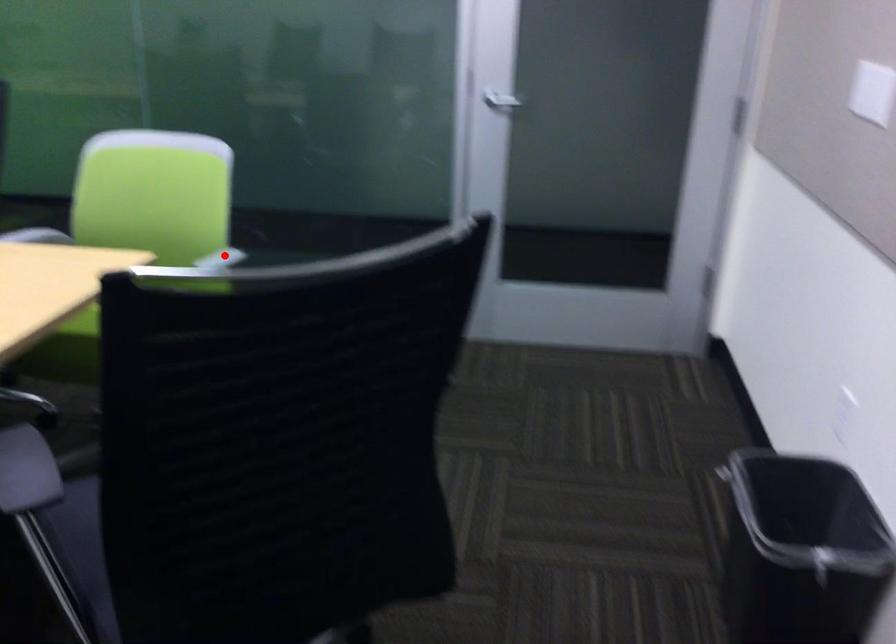
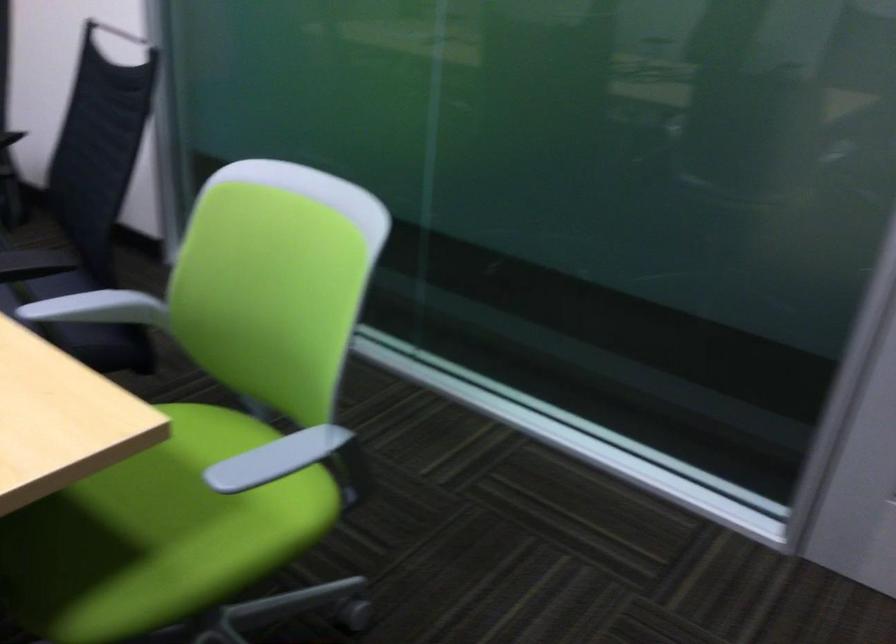
Question: I am providing you with two images of the same scene from different viewpoints. In image1, a red point is highlighted. Considering the same 3D point in image2, which of the following is correct?

Choices:
 (A) It is closer
 (B) It is farther

Answer: (A)